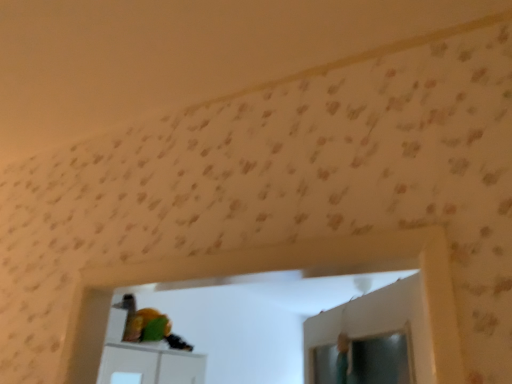
Question: Should I look upward or downward to see green matte parrot at center?

Choices:
 (A) down
 (B) up

Answer: (A)